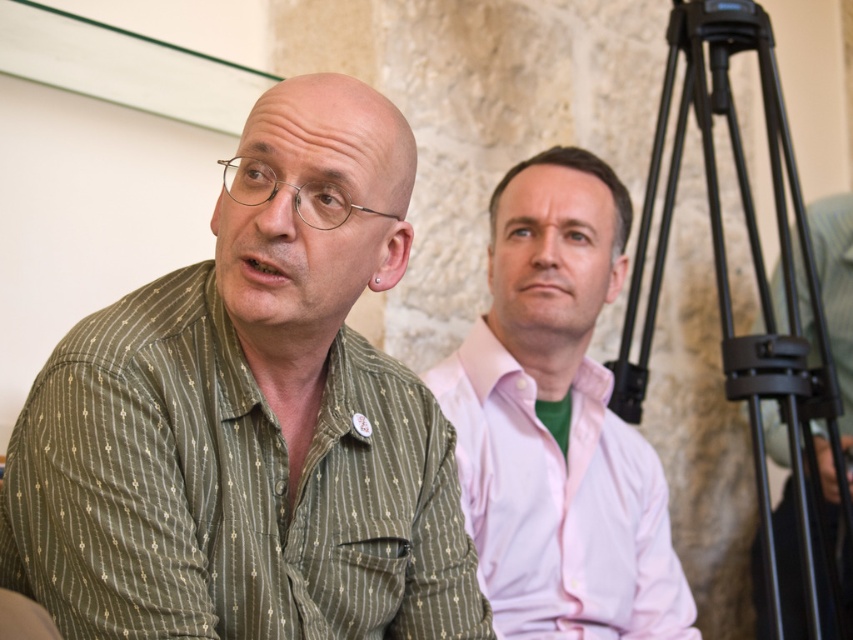
Question: Which point is closer to the camera?

Choices:
 (A) pink smooth shirt at center
 (B) black metal tripod at right

Answer: (A)

Question: Estimate the real-world distances between objects in this image. Which object is farther from the green striped shirt at left?

Choices:
 (A) black metal tripod at right
 (B) pink smooth shirt at center

Answer: (A)

Question: Is pink smooth shirt at center closer to the viewer compared to black metal tripod at right?

Choices:
 (A) yes
 (B) no

Answer: (A)

Question: Can you confirm if green striped shirt at left is smaller than pink smooth shirt at center?

Choices:
 (A) no
 (B) yes

Answer: (A)

Question: Among these points, which one is farthest from the camera?

Choices:
 (A) (527, 484)
 (B) (790, 304)
 (C) (279, 600)

Answer: (B)

Question: Where is green striped shirt at left located in relation to pink smooth shirt at center in the image?

Choices:
 (A) right
 (B) left

Answer: (B)